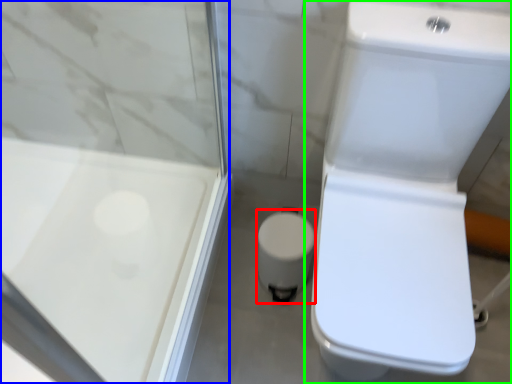
Question: Considering the real-world distances, which object is closest to porcelain (highlighted by a red box)? screen door (highlighted by a blue box) or toilet (highlighted by a green box).

Choices:
 (A) screen door
 (B) toilet

Answer: (B)